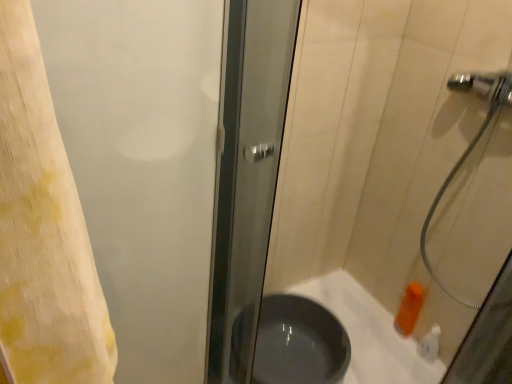
At what (x,y) coordinates should I click in order to perform the action: click on matte black basin at center. Please return your answer as a coordinate pair (x, y). This screenshot has height=384, width=512. Looking at the image, I should click on (298, 343).

Describe the element at coordinates (298, 343) in the screenshot. I see `matte black basin at center` at that location.

This screenshot has width=512, height=384. Identify the location of matte black basin at center. (298, 343).

Consider the image. Between white plastic bottle at lower right and matte black basin at center, which one has less height?

white plastic bottle at lower right.

Between white plastic bottle at lower right and matte black basin at center, which one appears on the left side from the viewer's perspective?

Positioned to the left is matte black basin at center.

Does white plastic bottle at lower right have a greater width compared to matte black basin at center?

In fact, white plastic bottle at lower right might be narrower than matte black basin at center.

How different are the orientations of white plastic bottle at lower right and matte black basin at center in degrees?

The facing directions of white plastic bottle at lower right and matte black basin at center are 90 degrees apart.

Is white plastic bottle at lower right aimed at frosted glass screen door at left?

Yes.

From the image's perspective, is white plastic bottle at lower right positioned above or below frosted glass screen door at left?

white plastic bottle at lower right is below frosted glass screen door at left.

Considering the relative sizes of white plastic bottle at lower right and frosted glass screen door at left in the image provided, is white plastic bottle at lower right shorter than frosted glass screen door at left?

Yes, white plastic bottle at lower right is shorter than frosted glass screen door at left.

Does white plastic bottle at lower right have a greater width compared to frosted glass screen door at left?

In fact, white plastic bottle at lower right might be narrower than frosted glass screen door at left.

Which point is more distant from viewer, (193, 120) or (291, 348)?

The point (291, 348) is more distant.

Based on their positions, is frosted glass screen door at left located to the left or right of matte black basin at center?

frosted glass screen door at left is to the left of matte black basin at center.

Considering the relative sizes of frosted glass screen door at left and matte black basin at center in the image provided, is frosted glass screen door at left thinner than matte black basin at center?

Correct, the width of frosted glass screen door at left is less than that of matte black basin at center.

Between frosted glass screen door at left and matte black basin at center, which one has less height?

matte black basin at center.

From a real-world perspective, between frosted glass screen door at left and white plastic bottle at lower right, who is vertically higher?

frosted glass screen door at left is physically above.

Considering the sizes of objects frosted glass screen door at left and white plastic bottle at lower right in the image provided, who is shorter, frosted glass screen door at left or white plastic bottle at lower right?

white plastic bottle at lower right is shorter.

Looking at this image, considering the positions of objects frosted glass screen door at left and white plastic bottle at lower right in the image provided, who is in front, frosted glass screen door at left or white plastic bottle at lower right?

Positioned in front is frosted glass screen door at left.

From the image's perspective, which is below, frosted glass screen door at left or matte gray bath at lower right?

matte gray bath at lower right, from the image's perspective.

From a real-world perspective, is frosted glass screen door at left on matte gray bath at lower right?

Correct, in the physical world, frosted glass screen door at left is higher than matte gray bath at lower right.

Visually, is frosted glass screen door at left positioned to the left or to the right of matte gray bath at lower right?

In the image, frosted glass screen door at left appears on the left side of matte gray bath at lower right.

Between frosted glass screen door at left and matte gray bath at lower right, which one has larger size?

matte gray bath at lower right is bigger.

Looking at this image, does matte gray bath at lower right have a lesser width compared to white plastic bottle at lower right?

In fact, matte gray bath at lower right might be wider than white plastic bottle at lower right.

From the image's perspective, which one is positioned lower, matte gray bath at lower right or white plastic bottle at lower right?

matte gray bath at lower right is shown below in the image.

Would you say matte gray bath at lower right is to the left or to the right of white plastic bottle at lower right in the picture?

Based on their positions, matte gray bath at lower right is located to the left of white plastic bottle at lower right.

From a real-world perspective, is matte gray bath at lower right positioned under white plastic bottle at lower right based on gravity?

Yes, from a real-world perspective, matte gray bath at lower right is beneath white plastic bottle at lower right.

In the image, there is a matte black basin at center. At what (x,y) coordinates should I click in order to perform the action: click on bath below it (from a real-world perspective). Please return your answer as a coordinate pair (x, y). The height and width of the screenshot is (384, 512). Looking at the image, I should click on (370, 333).

Is matte gray bath at lower right placed right next to matte black basin at center?

No, matte gray bath at lower right is not touching matte black basin at center.

Is matte gray bath at lower right not inside matte black basin at center?

Absolutely, matte gray bath at lower right is external to matte black basin at center.

Where is `toiletry above the matte black basin at center (from the image's perspective)`? The height and width of the screenshot is (384, 512). toiletry above the matte black basin at center (from the image's perspective) is located at coordinates (430, 344).

Identify the location of toiletry below the frosted glass screen door at left (from the image's perspective). (430, 344).

Estimate the real-world distances between objects in this image. Which object is closer to frosted glass screen door at left, matte gray bath at lower right or white plastic bottle at lower right?

matte gray bath at lower right lies closer to frosted glass screen door at left than the other object.

Based on their spatial positions, is white plastic bottle at lower right or matte black basin at center further from frosted glass screen door at left?

Based on the image, white plastic bottle at lower right appears to be further to frosted glass screen door at left.

Looking at the image, which one is located further to matte gray bath at lower right, frosted glass screen door at left or white plastic bottle at lower right?

frosted glass screen door at left.

Based on their spatial positions, is matte gray bath at lower right or matte black basin at center further from white plastic bottle at lower right?

matte black basin at center is further to white plastic bottle at lower right.

Based on their spatial positions, is white plastic bottle at lower right or matte black basin at center closer to matte gray bath at lower right?

Based on the image, matte black basin at center appears to be nearer to matte gray bath at lower right.

When comparing their distances from matte gray bath at lower right, does matte black basin at center or frosted glass screen door at left seem closer?

→ matte black basin at center is positioned closer to the anchor matte gray bath at lower right.

Looking at the image, which one is located closer to matte black basin at center, frosted glass screen door at left or matte gray bath at lower right?

matte gray bath at lower right is positioned closer to the anchor matte black basin at center.

Which object lies further to the anchor point frosted glass screen door at left, matte black basin at center or matte gray bath at lower right?

matte gray bath at lower right is positioned further to the anchor frosted glass screen door at left.

You are a GUI agent. You are given a task and a screenshot of the screen. Output one action in this format:
    pyautogui.click(x=<x>, y=<y>)
    Task: Click on the bath between frosted glass screen door at left and matte black basin at center along the z-axis
    The height and width of the screenshot is (384, 512).
    Given the screenshot: What is the action you would take?
    pyautogui.click(x=370, y=333)

You are a GUI agent. You are given a task and a screenshot of the screen. Output one action in this format:
    pyautogui.click(x=<x>, y=<y>)
    Task: Click on the bath between matte black basin at center and white plastic bottle at lower right
    The image size is (512, 384).
    Given the screenshot: What is the action you would take?
    pyautogui.click(x=370, y=333)

Where is `bath situated between frosted glass screen door at left and white plastic bottle at lower right from left to right`? bath situated between frosted glass screen door at left and white plastic bottle at lower right from left to right is located at coordinates (370, 333).

Where is `basin between frosted glass screen door at left and white plastic bottle at lower right in the front-back direction`? basin between frosted glass screen door at left and white plastic bottle at lower right in the front-back direction is located at coordinates (298, 343).